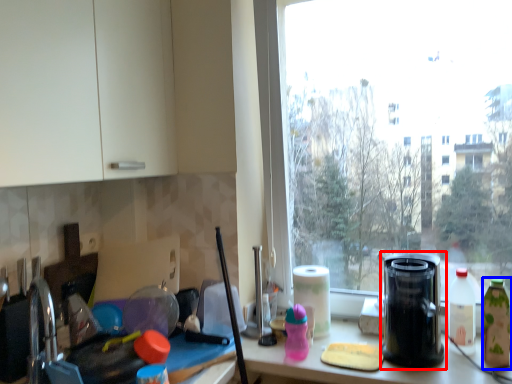
Question: Among these objects, which one is farthest to the camera, kitchen appliance (highlighted by a red box) or bottle (highlighted by a blue box)?

Choices:
 (A) kitchen appliance
 (B) bottle

Answer: (B)